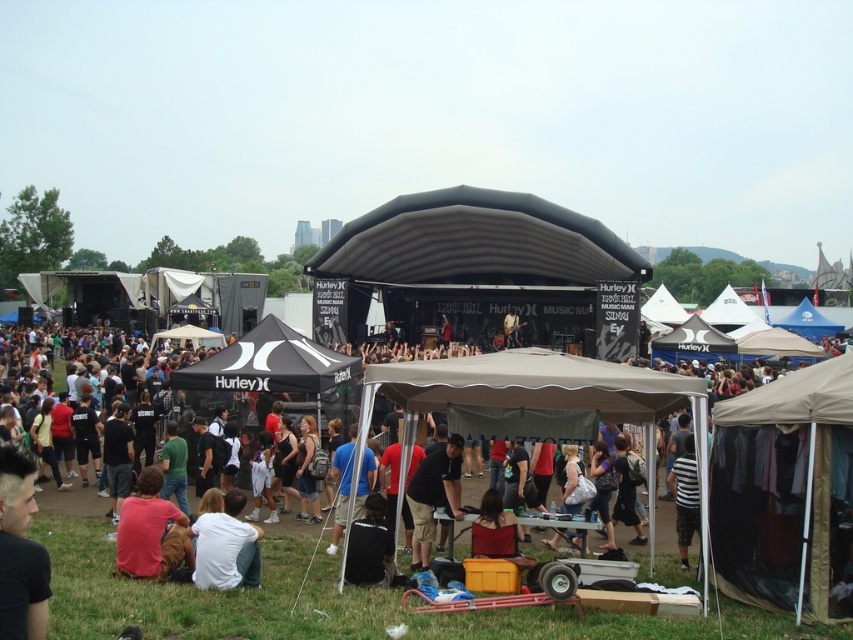
In the scene shown: You are a photographer at the music festival. You want to capture a photo of the blue fabric tent at center without including the matte red shirt at lower left in the frame. Is this possible given their current positions?

The matte red shirt at lower left is positioned over the blue fabric tent at center, so it is blocking the view. Therefore, it is not possible to capture the blue fabric tent at center without including the matte red shirt at lower left in the frame.

You are a festival attendee looking for the merchandise tent. You see the tan fabric tent at lower right and the black fabric canopy at center. Which one is closer to the ground?

The tan fabric tent at lower right is below the black fabric canopy at center, so it is closer to the ground.